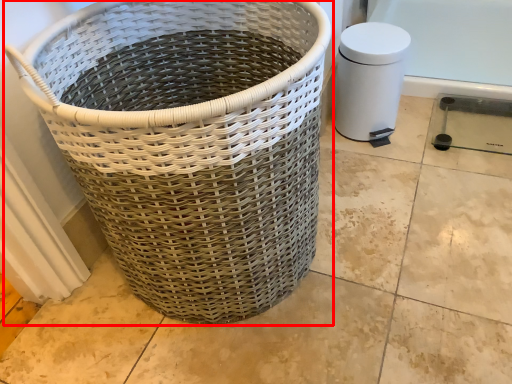
Question: Considering the relative positions of waste container (annotated by the red box) and water heater in the image provided, where is waste container (annotated by the red box) located with respect to the staircase?

Choices:
 (A) left
 (B) right

Answer: (A)